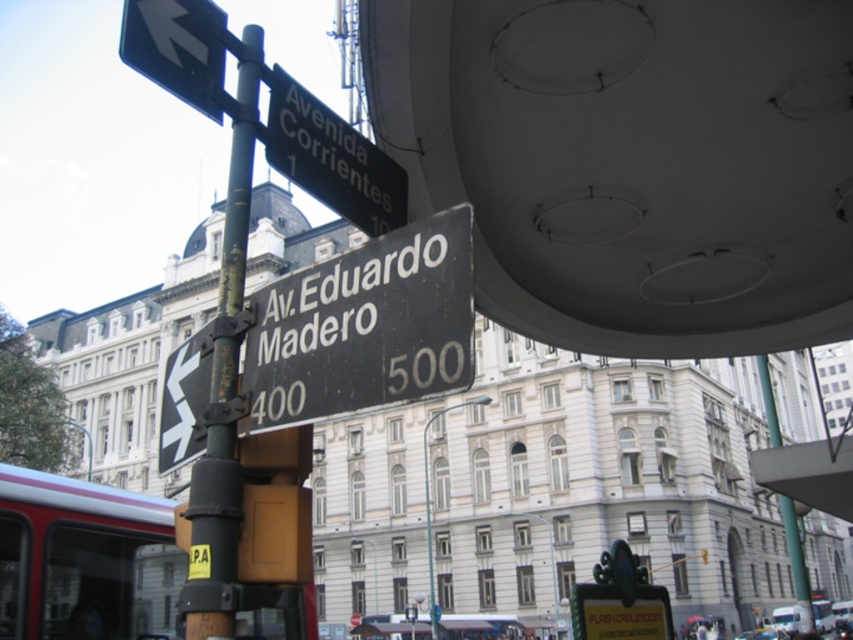
Between point (209, 51) and point (813, 625), which one is positioned in front?

Point (209, 51) is more forward.

Locate an element on the screen. The width and height of the screenshot is (853, 640). black plastic arrow at upper left is located at coordinates (177, 49).

The image size is (853, 640). I want to click on black plastic arrow at upper left, so click(x=177, y=49).

Identify the location of black plastic street sign at upper center. This screenshot has height=640, width=853. (331, 157).

Find the location of `black plastic street sign at upper center`. black plastic street sign at upper center is located at coordinates (331, 157).

Does rusty metal pole at upper left have a greater width compared to green metallic pole at upper center?

No.

Between rusty metal pole at upper left and green metallic pole at upper center, which one has less height?

rusty metal pole at upper left is shorter.

Is point (219, 305) positioned in front of point (805, 611)?

Yes, it is in front of point (805, 611).

This screenshot has height=640, width=853. Identify the location of rusty metal pole at upper left. (224, 387).